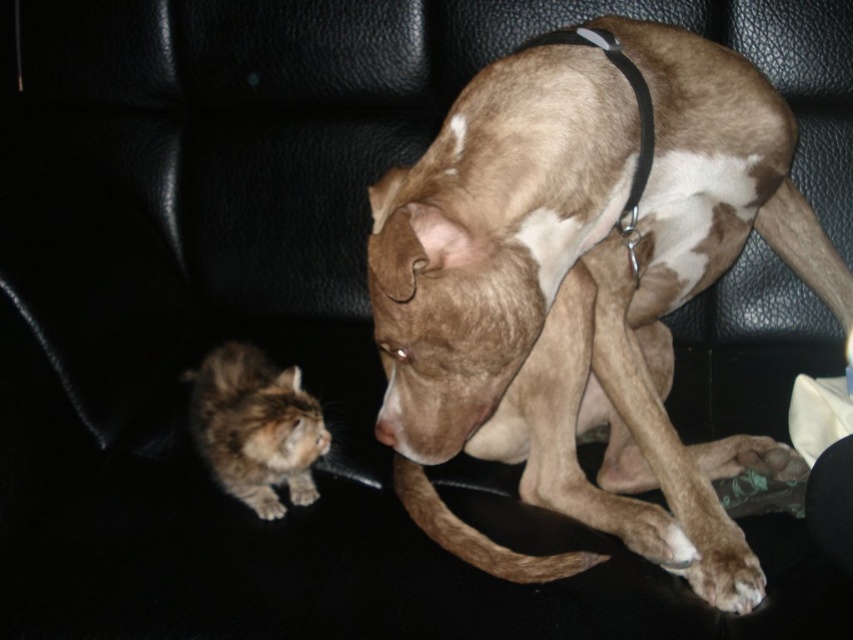
Does brown speckled fur dog at center have a smaller size compared to fluffy brown cat at lower left?

Actually, brown speckled fur dog at center might be larger than fluffy brown cat at lower left.

This screenshot has width=853, height=640. What do you see at coordinates (584, 288) in the screenshot?
I see `brown speckled fur dog at center` at bounding box center [584, 288].

The width and height of the screenshot is (853, 640). Identify the location of brown speckled fur dog at center. [x=584, y=288].

I want to click on brown speckled fur dog at center, so click(584, 288).